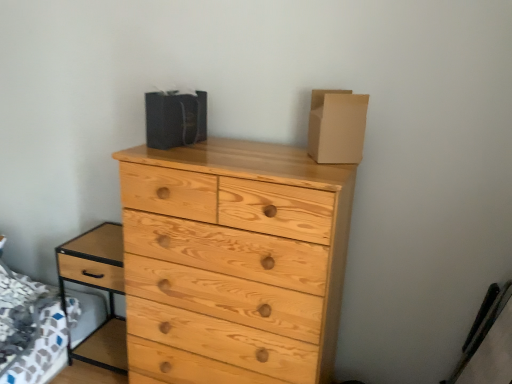
Find the location of `vacant area that is situated to the right of matte black bag at upper center, positioned as the 1th cardboard box in left-to-right order`. vacant area that is situated to the right of matte black bag at upper center, positioned as the 1th cardboard box in left-to-right order is located at coordinates tap(218, 142).